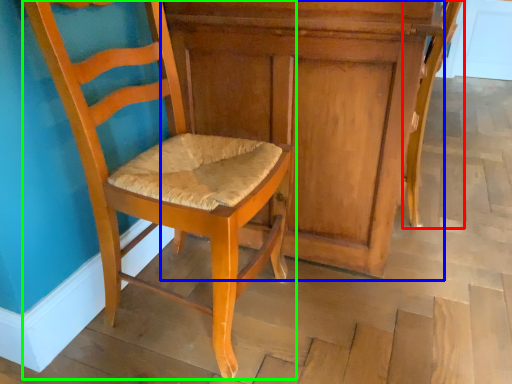
Question: Estimate the real-world distances between objects in this image. Which object is closer to chair (highlighted by a red box), dresser (highlighted by a blue box) or chair (highlighted by a green box)?

Choices:
 (A) dresser
 (B) chair

Answer: (A)